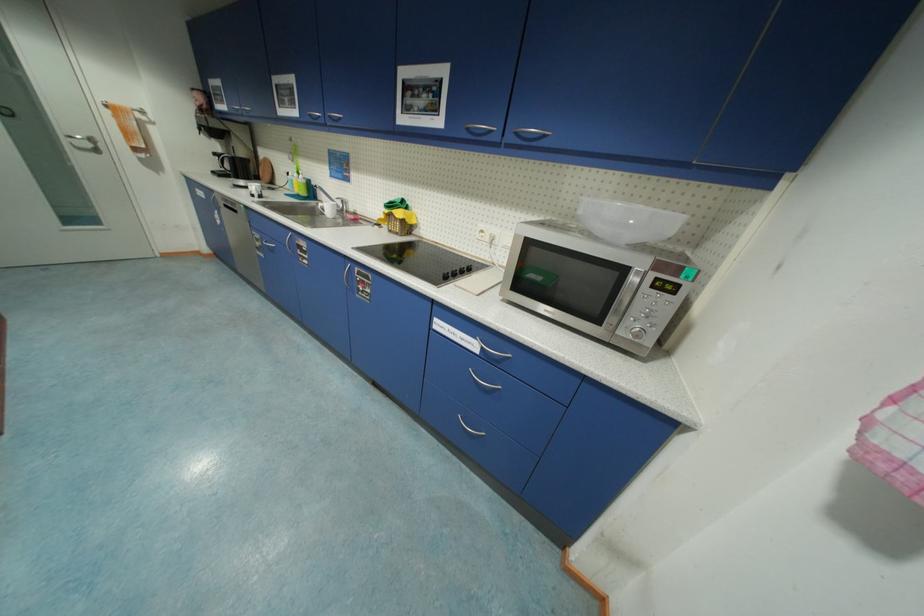
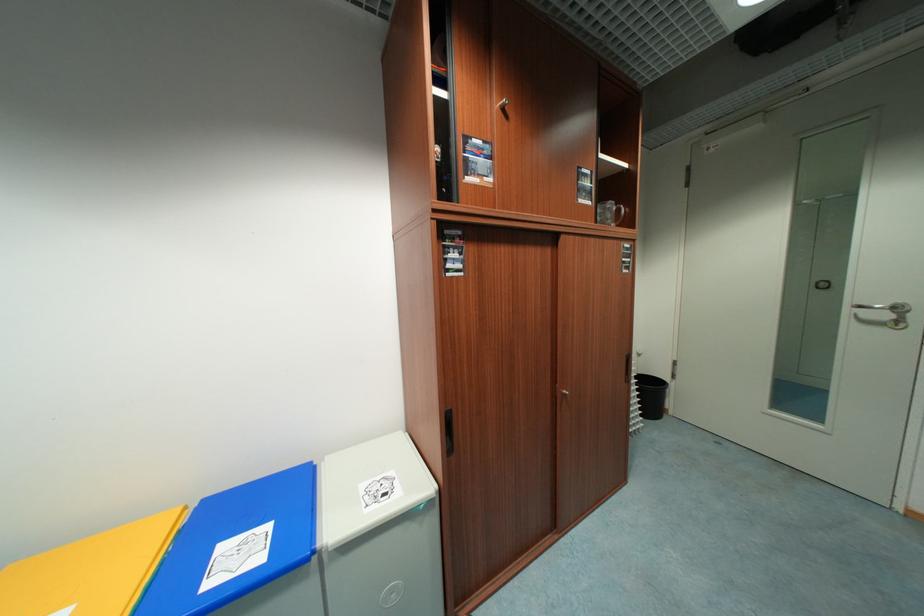
In the second image, find the point that corresponds to [98,140] in the first image.

(904, 310)